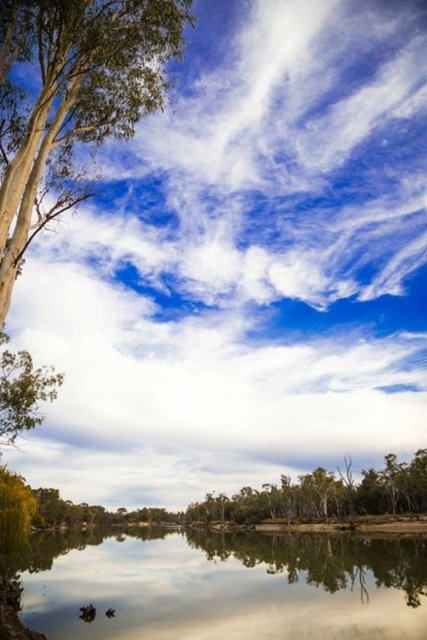
Does reflective glass water at lower center appear over smooth water at lower center?

No.

Is point (143, 579) farther from viewer compared to point (257, 541)?

No.

Is point (78, 620) farther from viewer compared to point (249, 540)?

No, it is not.

This screenshot has width=427, height=640. I want to click on reflective glass water at lower center, so click(225, 586).